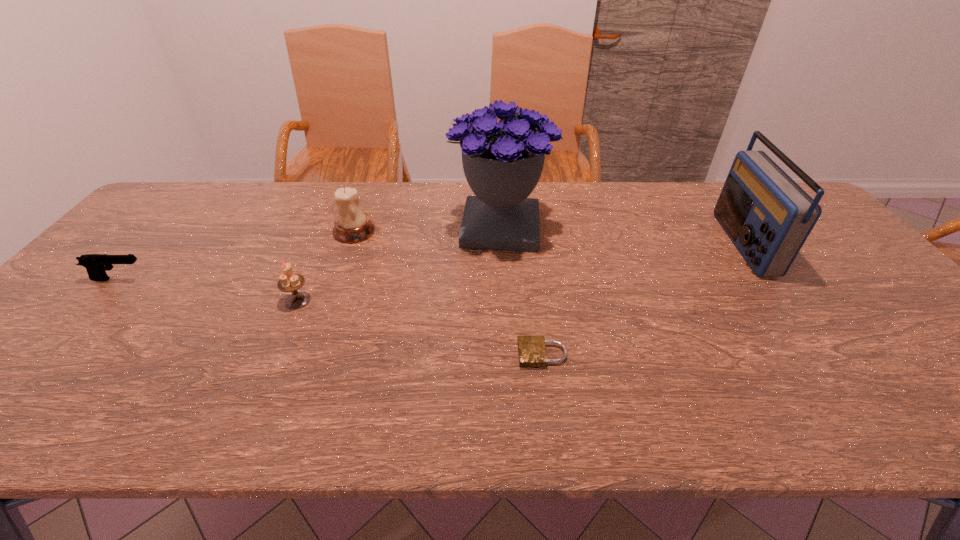
Image resolution: width=960 pixels, height=540 pixels. I want to click on padlock, so click(532, 352).

In order to click on free space located 0.130m on the left of the tallest object in this screenshot , I will do coord(408,227).

Where is `vacant space located on the front panel of the rightmost object`? The width and height of the screenshot is (960, 540). vacant space located on the front panel of the rightmost object is located at coordinates (665, 244).

Image resolution: width=960 pixels, height=540 pixels. In order to click on vacant space located on the front panel of the rightmost object in this screenshot , I will do `click(635, 244)`.

Identify the location of vacant area located on the front panel of the rightmost object. This screenshot has height=540, width=960. (608, 244).

The height and width of the screenshot is (540, 960). I want to click on free space located on the left of the farther candle holder, so [x=294, y=231].

The width and height of the screenshot is (960, 540). I want to click on free location located 0.310m on the left of the nearer candle holder, so click(x=162, y=300).

At what (x,y) coordinates should I click in order to perform the action: click on free location located on the front-facing side of the pistol. Please return your answer as a coordinate pair (x, y). Looking at the image, I should click on (189, 279).

I want to click on free space located on the keyhole side of the padlock, so click(x=380, y=354).

I want to click on vacant area situated on the keyhole side of the padlock, so click(407, 354).